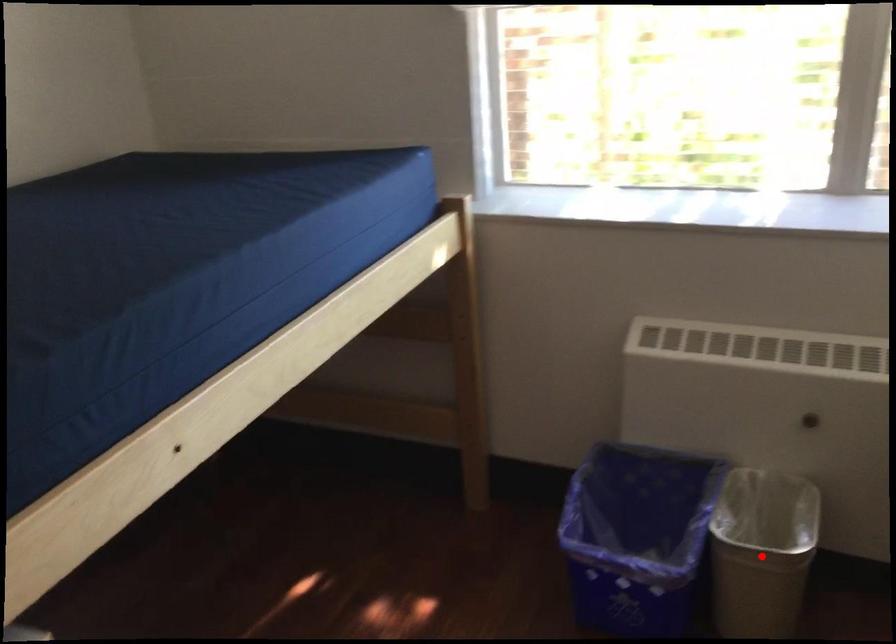
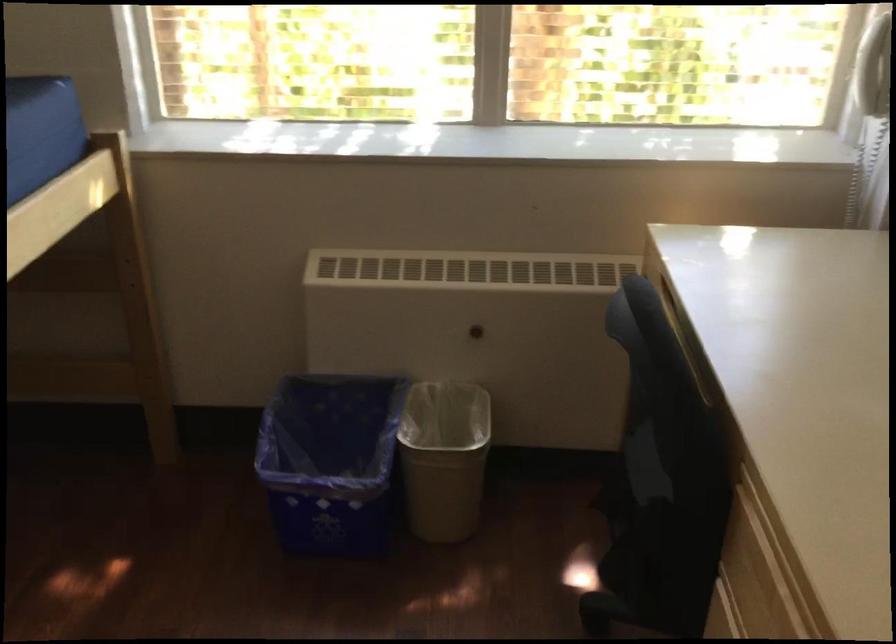
Where in the second image is the point corresponding to the highlighted location from the first image?

(444, 458)